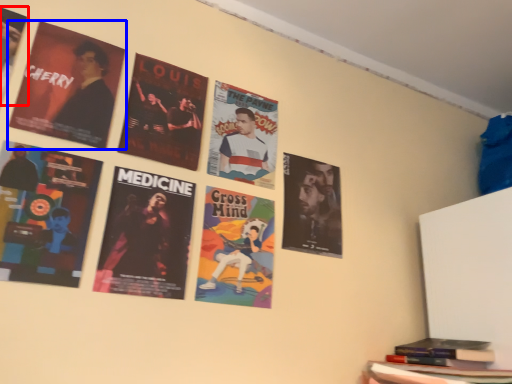
Question: Which object appears closest to the camera in this image, poster (highlighted by a red box) or poster (highlighted by a blue box)?

Choices:
 (A) poster
 (B) poster

Answer: (A)